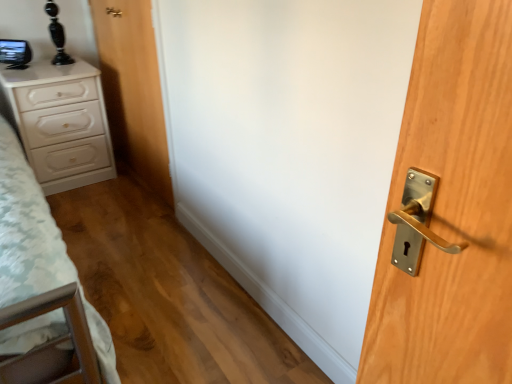
The width and height of the screenshot is (512, 384). I want to click on vacant area that is in front of white glossy chest of drawers at left, so click(80, 202).